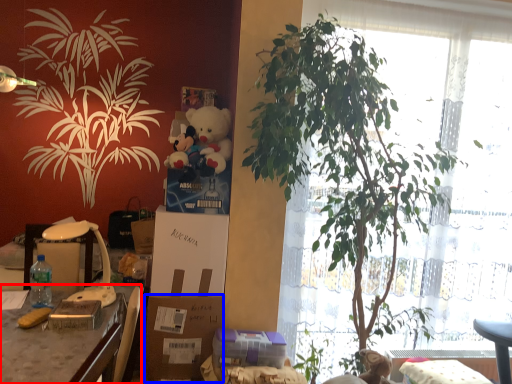
Question: Among these objects, which one is farthest to the camera, desk (highlighted by a red box) or cardboard box (highlighted by a blue box)?

Choices:
 (A) desk
 (B) cardboard box

Answer: (B)